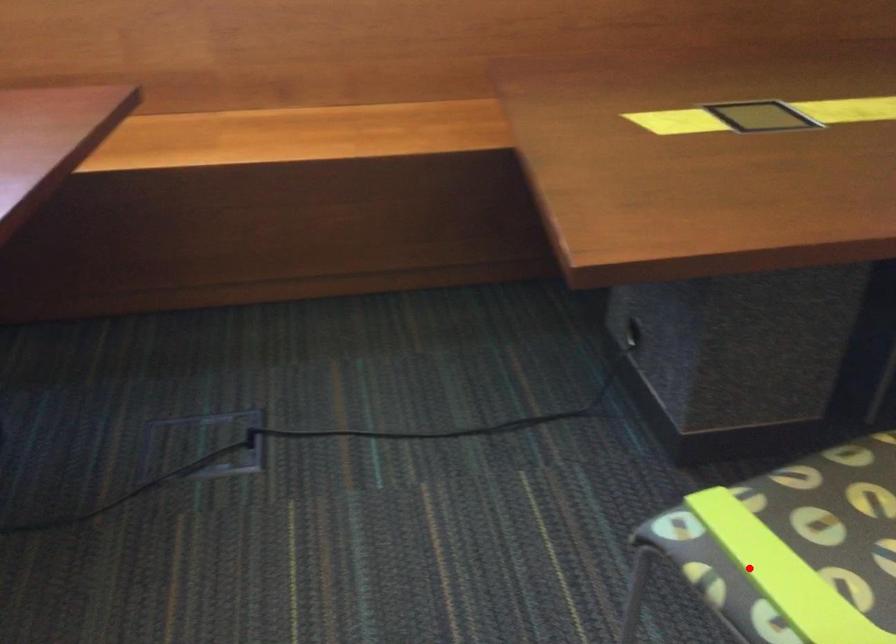
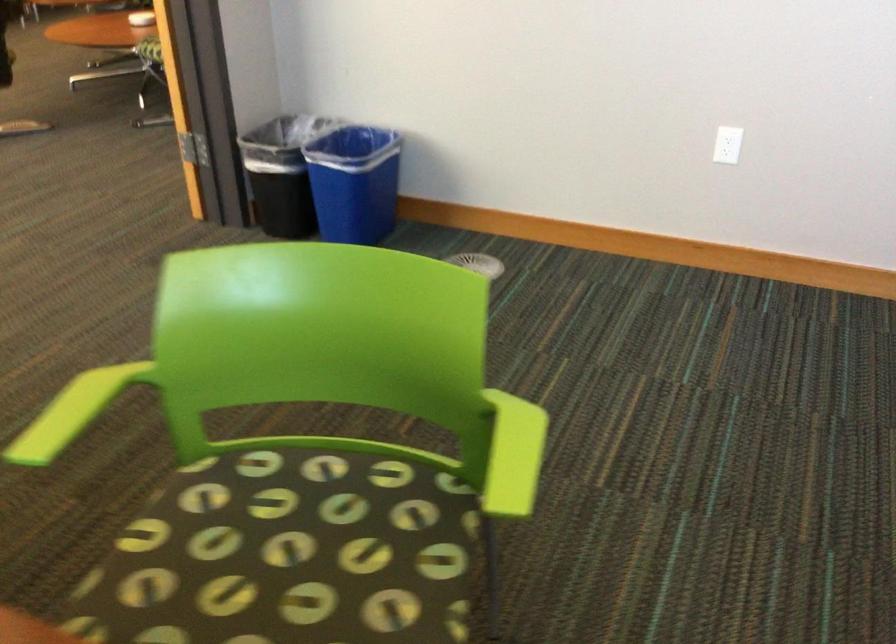
Question: I am providing you with two images of the same scene from different viewpoints. Given a red point in image1, look at the same physical point in image2. Is it:

Choices:
 (A) Closer to the viewpoint
 (B) Farther from the viewpoint

Answer: (B)